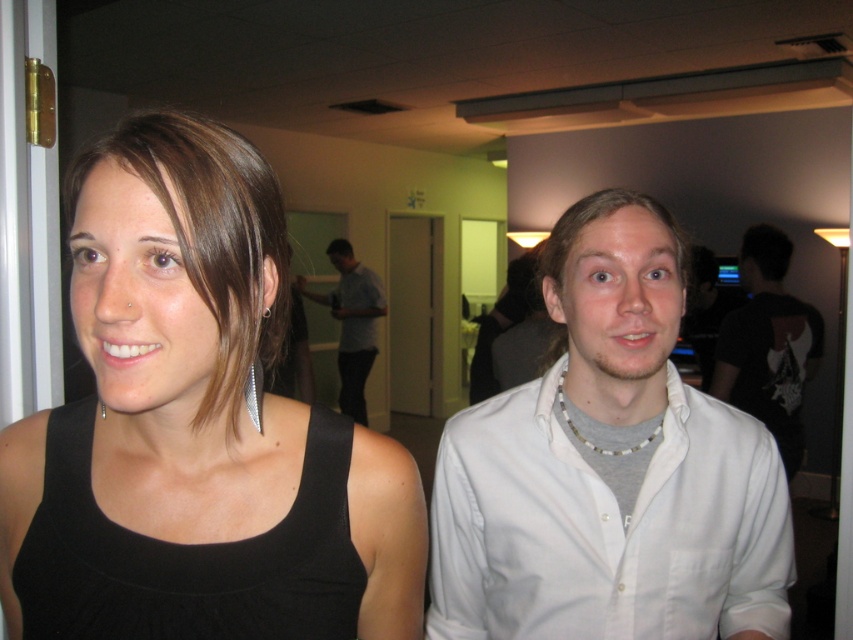
Question: Is black matte tank top at left to the right of black cotton t-shirt at right from the viewer's perspective?

Choices:
 (A) yes
 (B) no

Answer: (B)

Question: Which is nearer to the black cotton t-shirt at right?

Choices:
 (A) black matte tank top at left
 (B) white cotton shirt at right
 (C) silver metallic earring at left ear

Answer: (B)

Question: Where is black fabric tank top at left located in relation to white cotton shirt at right in the image?

Choices:
 (A) above
 (B) below

Answer: (A)

Question: From the image, what is the correct spatial relationship of white cotton shirt at right in relation to black cotton t-shirt at right?

Choices:
 (A) below
 (B) above

Answer: (A)

Question: Which object is farther from the camera taking this photo?

Choices:
 (A) light blue shirt at center
 (B) black cotton t-shirt at right

Answer: (A)

Question: Which point appears farthest from the camera in this image?

Choices:
 (A) (177, 188)
 (B) (735, 582)

Answer: (B)